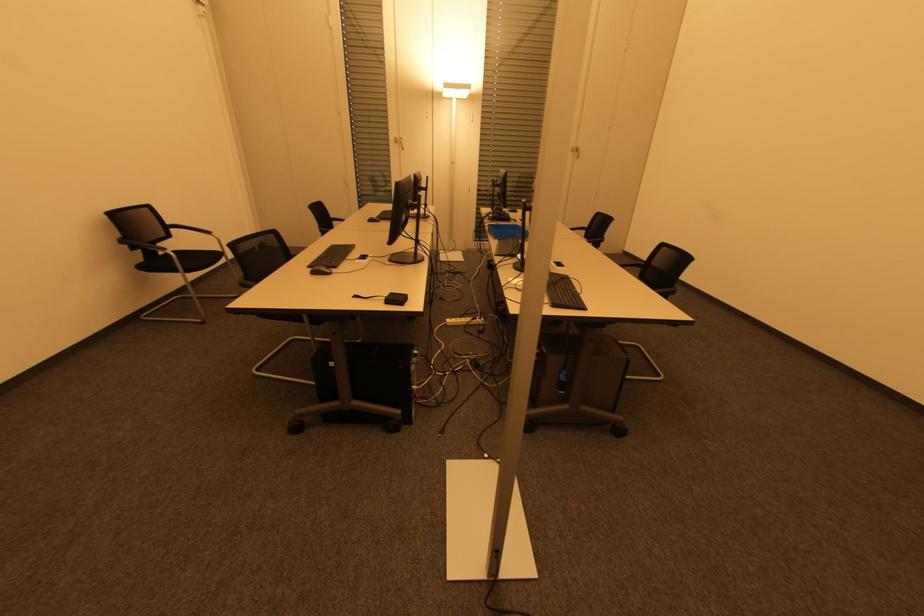
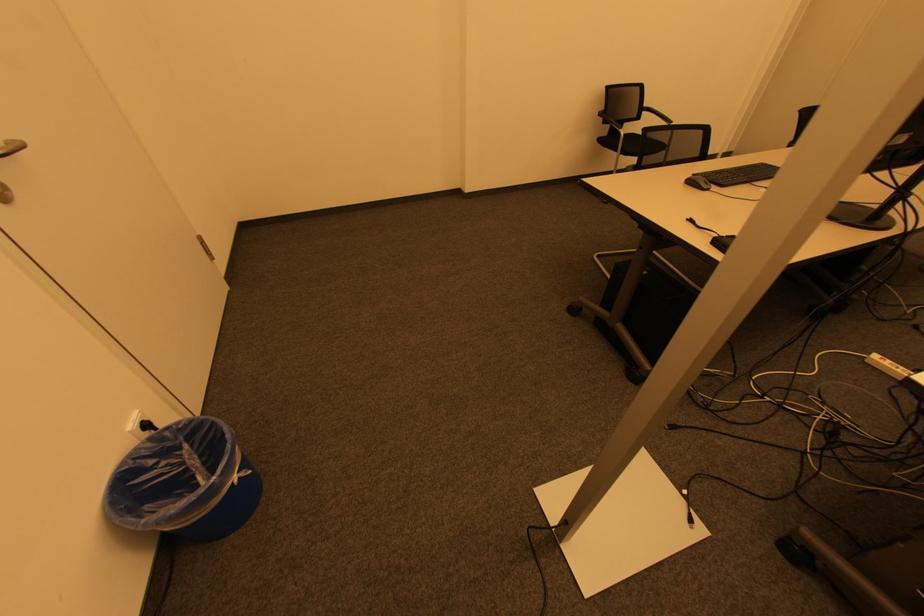
How did the camera likely rotate?

The camera rotated toward left-down.